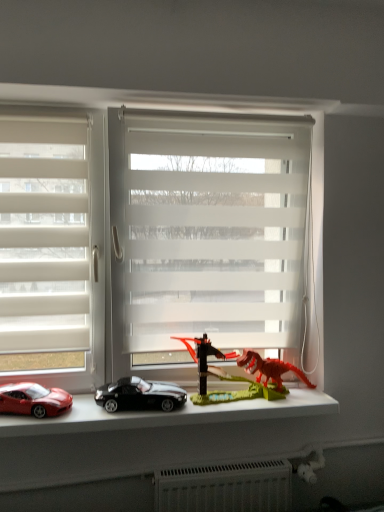
Question: Does shiny red car at lower left, which is the first car from left to right, appear on the right side of white translucent blinds at center, arranged as the first window when viewed from the right?

Choices:
 (A) yes
 (B) no

Answer: (B)

Question: From a real-world perspective, is shiny red car at lower left, which is the first car from left to right, beneath white translucent blinds at center, placed as the 2th window when sorted from left to right?

Choices:
 (A) yes
 (B) no

Answer: (A)

Question: Is shiny red car at lower left, which is the first car from left to right, aimed at white translucent blinds at center, placed as the 2th window when sorted from left to right?

Choices:
 (A) yes
 (B) no

Answer: (A)

Question: Is shiny red car at lower left, placed as the 2th car when sorted from right to left, bigger than white translucent blinds at center, placed as the 2th window when sorted from left to right?

Choices:
 (A) no
 (B) yes

Answer: (A)

Question: From the image's perspective, does shiny red car at lower left, placed as the 2th car when sorted from right to left, appear lower than white translucent blinds at center, arranged as the first window when viewed from the right?

Choices:
 (A) no
 (B) yes

Answer: (B)

Question: Considering the relative sizes of shiny red car at lower left, placed as the 2th car when sorted from right to left, and white translucent blinds at center, placed as the 2th window when sorted from left to right, in the image provided, is shiny red car at lower left, placed as the 2th car when sorted from right to left, smaller than white translucent blinds at center, placed as the 2th window when sorted from left to right,?

Choices:
 (A) no
 (B) yes

Answer: (B)

Question: From a real-world perspective, is white translucent blinds at center, placed as the 2th window when sorted from left to right, positioned over shiny black car at center, the 2th car from the left, based on gravity?

Choices:
 (A) yes
 (B) no

Answer: (A)

Question: Considering the relative sizes of white translucent blinds at center, placed as the 2th window when sorted from left to right, and shiny black car at center, the 2th car from the left, in the image provided, is white translucent blinds at center, placed as the 2th window when sorted from left to right, wider than shiny black car at center, the 2th car from the left,?

Choices:
 (A) yes
 (B) no

Answer: (A)

Question: Does white translucent blinds at center, arranged as the first window when viewed from the right, have a lesser width compared to shiny black car at center, placed as the first car when sorted from right to left?

Choices:
 (A) yes
 (B) no

Answer: (B)

Question: Could you tell me if white translucent blinds at center, arranged as the first window when viewed from the right, is facing shiny black car at center, placed as the first car when sorted from right to left?

Choices:
 (A) no
 (B) yes

Answer: (B)

Question: Can you confirm if white translucent blinds at center, placed as the 2th window when sorted from left to right, is positioned to the right of shiny black car at center, the 2th car from the left?

Choices:
 (A) no
 (B) yes

Answer: (B)

Question: From a real-world perspective, is white translucent blinds at center, arranged as the first window when viewed from the right, below shiny black car at center, placed as the first car when sorted from right to left?

Choices:
 (A) no
 (B) yes

Answer: (A)

Question: Can you confirm if white translucent blinds at left, which ranks as the second window in right-to-left order, is smaller than shiny red car at lower left, placed as the 2th car when sorted from right to left?

Choices:
 (A) yes
 (B) no

Answer: (B)